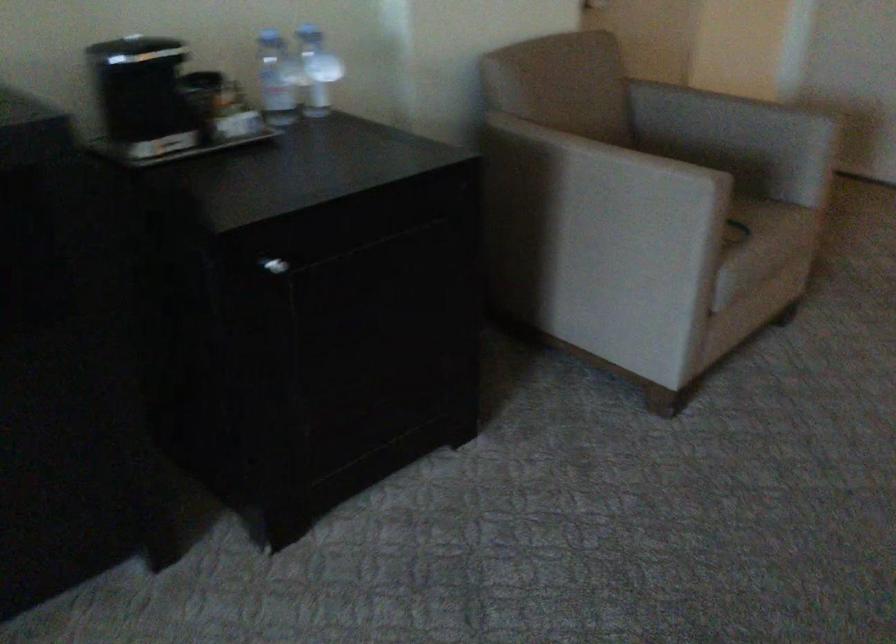
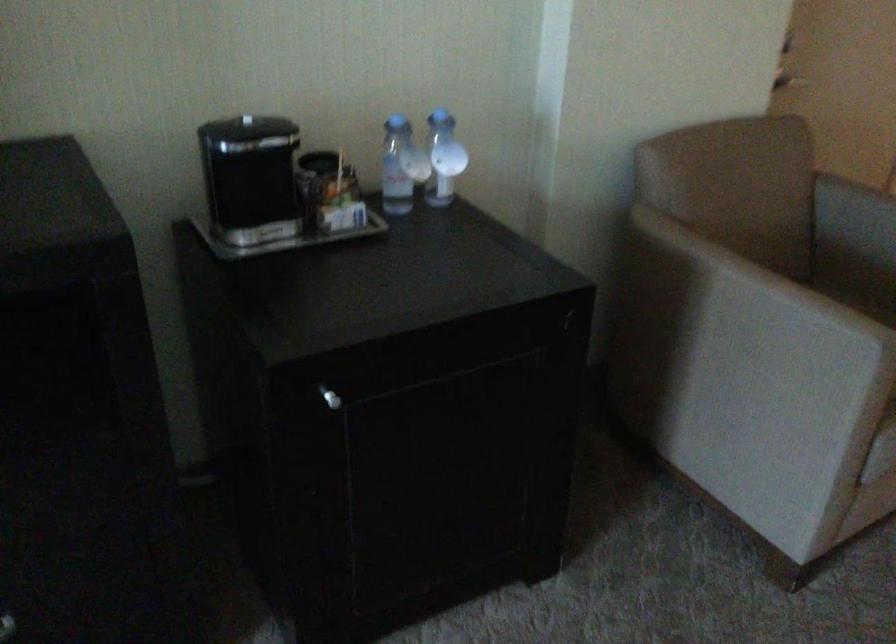
Locate, in the second image, the point that corresponds to the point at 595,190 in the first image.

(739, 319)